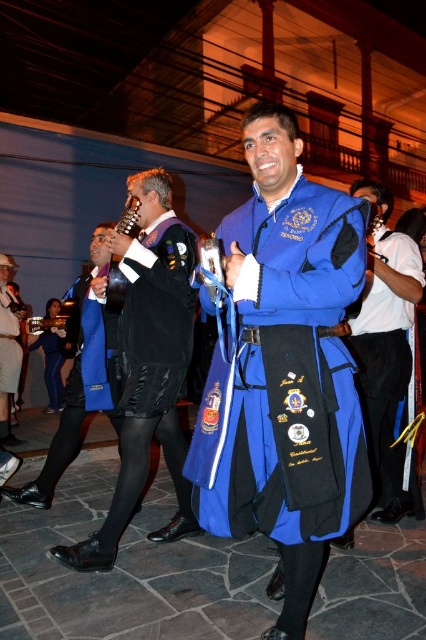
Question: Which of the following is the closest to the observer?

Choices:
 (A) brushed metal violin at center
 (B) metallic gold trumpet at center
 (C) blue velvet robe at center

Answer: (C)

Question: Does blue velvet robe at center appear under matte black robe at center?

Choices:
 (A) no
 (B) yes

Answer: (B)

Question: Does blue fabric uniform at center have a larger size compared to brushed metal violin at center?

Choices:
 (A) no
 (B) yes

Answer: (A)

Question: Is blue velvet robe at center to the left of black leather shoes at lower left from the viewer's perspective?

Choices:
 (A) yes
 (B) no

Answer: (B)

Question: Based on their relative distances, which object is farther from the blue satin sash at center?

Choices:
 (A) black leather shoes at lower left
 (B) brushed metal violin at center
 (C) metallic gold trumpet at center
 (D) blue fabric uniform at center

Answer: (D)

Question: Among these objects, which one is nearest to the camera?

Choices:
 (A) blue fabric uniform at center
 (B) brushed metal violin at center
 (C) blue velvet robe at center
 (D) black leather shoes at lower left

Answer: (C)